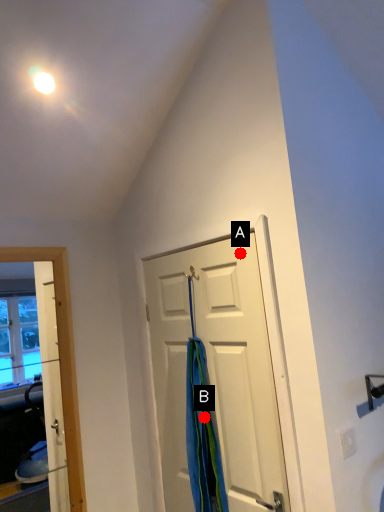
Question: Two points are circled on the image, labeled by A and B beside each circle. Which point is closer to the camera?

Choices:
 (A) A is closer
 (B) B is closer

Answer: (A)